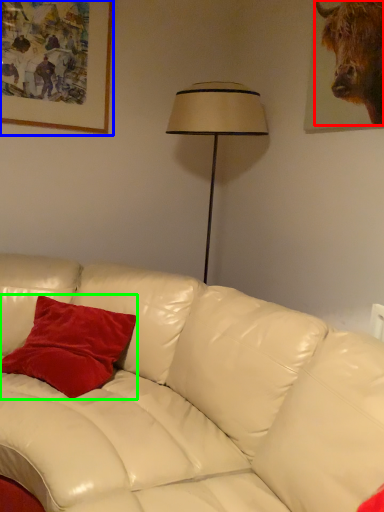
Question: Estimate the real-world distances between objects in this image. Which object is closer to bull (highlighted by a red box), picture frame (highlighted by a blue box) or pillow (highlighted by a green box)?

Choices:
 (A) picture frame
 (B) pillow

Answer: (A)